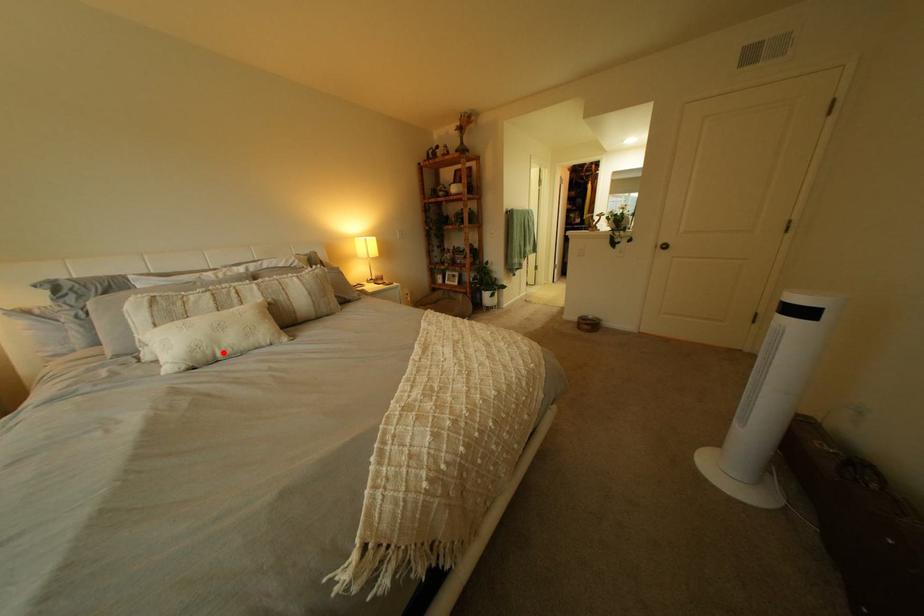
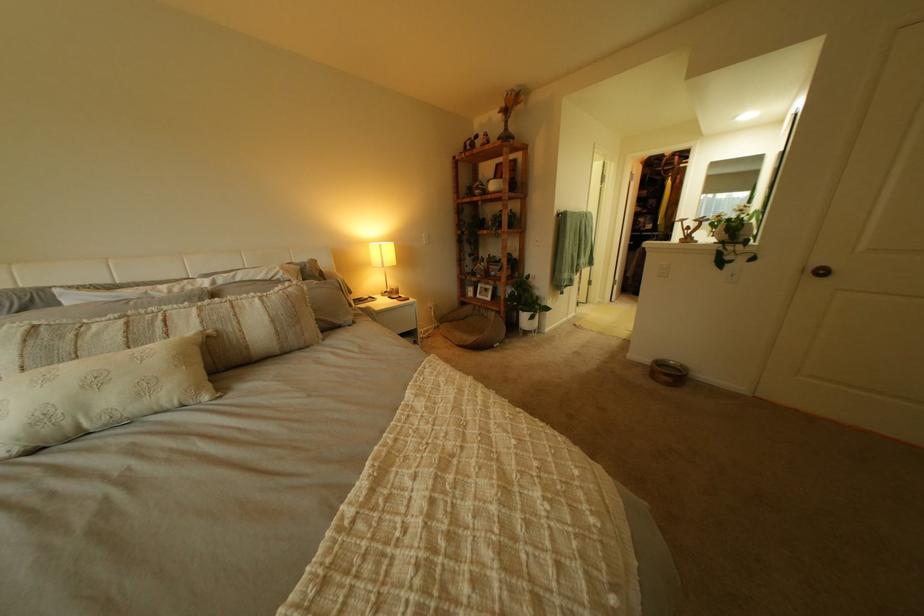
Locate, in the second image, the point that corresponds to the highlighted location in the first image.

(80, 424)